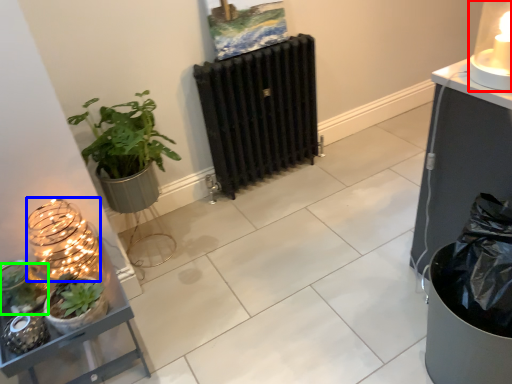
Question: Which is nearer to the candle holder (highlighted by a red box)? candle holder (highlighted by a blue box) or vegetation (highlighted by a green box).

Choices:
 (A) candle holder
 (B) vegetation

Answer: (A)